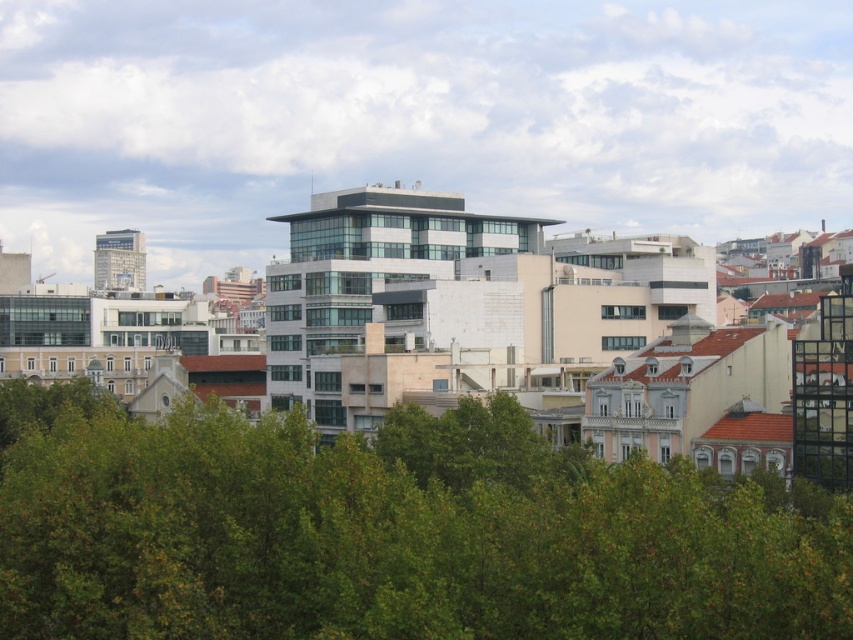
Can you confirm if green leafy tree at center is positioned to the right of matte glass skyscraper at left?

Indeed, green leafy tree at center is positioned on the right side of matte glass skyscraper at left.

Which is more to the left, green leafy tree at center or matte glass skyscraper at left?

From the viewer's perspective, matte glass skyscraper at left appears more on the left side.

Who is more distant from viewer, (279, 614) or (97, 268)?

The point (97, 268) is more distant.

This screenshot has width=853, height=640. Identify the location of green leafy tree at center. (389, 532).